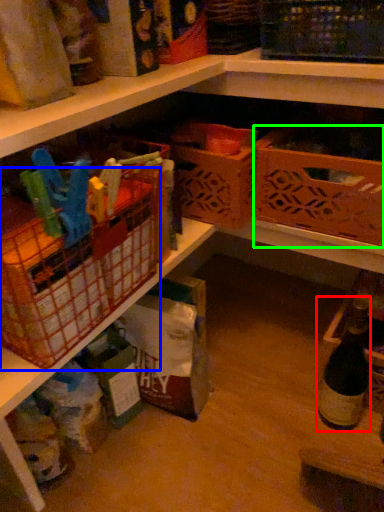
Question: Which object is positioned farthest from bottle (highlighted by a red box)? Select from basket (highlighted by a blue box) and basket (highlighted by a green box).

Choices:
 (A) basket
 (B) basket

Answer: (A)